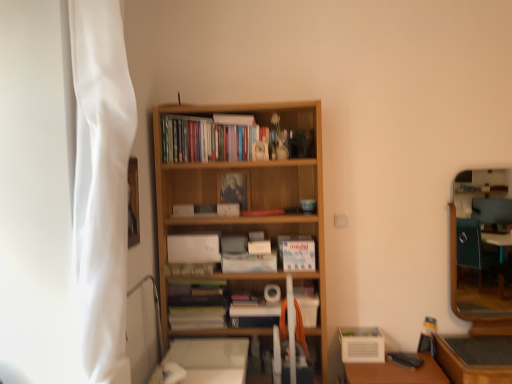
Question: From their relative heights in the image, would you say white matte paperback book at center, the 4th paperback book viewed from the top, is taller or shorter than matte wooden frame at center, the first paperback book positioned from the top?

Choices:
 (A) tall
 (B) short

Answer: (B)

Question: Do you think white matte paperback book at center, the 4th paperback book viewed from the top, is within matte wooden frame at center, the first paperback book positioned from the top, or outside of it?

Choices:
 (A) outside
 (B) inside

Answer: (A)

Question: Which is nearer to the blue matte paperback book at center, which is the second paperback book from top to bottom?

Choices:
 (A) wooden bookshelf at center, which is counted as the 2th book, starting from the right
 (B) wooden table at lower right
 (C) white matte paperback book at center, placed as the first paperback book when sorted from bottom to top
 (D) white matte paperback book at center, which appears as the 2th paperback book when ordered from the bottom
 (E) white fabric curtain at left

Answer: (D)

Question: Considering the real-world distances, which object is farthest from the wooden bookshelf at center, which is counted as the 2th book, starting from the right?

Choices:
 (A) white fabric curtain at left
 (B) wooden table at lower right
 (C) blue matte paperback book at center, which is the second paperback book from top to bottom
 (D) white matte paperback book at center, the 4th paperback book viewed from the top
 (E) matte wooden frame at center, the first paperback book positioned from the top

Answer: (B)